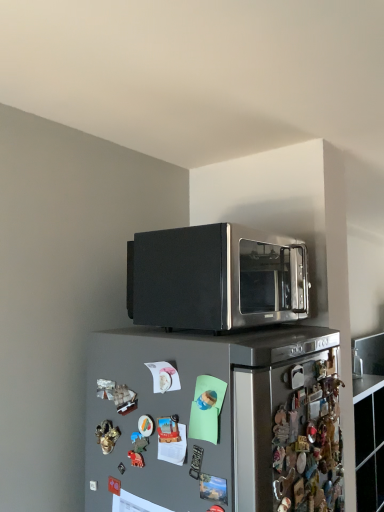
Question: Does satin black microwave at upper center lie in front of satin silver refrigerator at upper center?

Choices:
 (A) yes
 (B) no

Answer: (B)

Question: Is satin black microwave at upper center behind satin silver refrigerator at upper center?

Choices:
 (A) yes
 (B) no

Answer: (A)

Question: Considering the relative sizes of satin black microwave at upper center and satin silver refrigerator at upper center in the image provided, is satin black microwave at upper center wider than satin silver refrigerator at upper center?

Choices:
 (A) no
 (B) yes

Answer: (A)

Question: Can you confirm if satin black microwave at upper center is smaller than satin silver refrigerator at upper center?

Choices:
 (A) yes
 (B) no

Answer: (A)

Question: Considering the relative sizes of satin black microwave at upper center and satin silver refrigerator at upper center in the image provided, is satin black microwave at upper center bigger than satin silver refrigerator at upper center?

Choices:
 (A) no
 (B) yes

Answer: (A)

Question: Is satin black microwave at upper center to the right of satin silver refrigerator at upper center from the viewer's perspective?

Choices:
 (A) no
 (B) yes

Answer: (B)

Question: Are satin silver refrigerator at upper center and satin black microwave at upper center beside each other?

Choices:
 (A) yes
 (B) no

Answer: (B)

Question: Can you confirm if satin silver refrigerator at upper center is positioned to the left of satin black microwave at upper center?

Choices:
 (A) yes
 (B) no

Answer: (A)

Question: Considering the relative sizes of satin silver refrigerator at upper center and satin black microwave at upper center in the image provided, is satin silver refrigerator at upper center shorter than satin black microwave at upper center?

Choices:
 (A) yes
 (B) no

Answer: (B)

Question: Can you confirm if satin silver refrigerator at upper center is smaller than satin black microwave at upper center?

Choices:
 (A) no
 (B) yes

Answer: (A)

Question: From the image's perspective, does satin silver refrigerator at upper center appear lower than satin black microwave at upper center?

Choices:
 (A) no
 (B) yes

Answer: (B)

Question: Can you confirm if satin silver refrigerator at upper center is bigger than satin black microwave at upper center?

Choices:
 (A) yes
 (B) no

Answer: (A)

Question: Considering the positions of satin black microwave at upper center and satin silver refrigerator at upper center in the image, is satin black microwave at upper center taller or shorter than satin silver refrigerator at upper center?

Choices:
 (A) short
 (B) tall

Answer: (A)